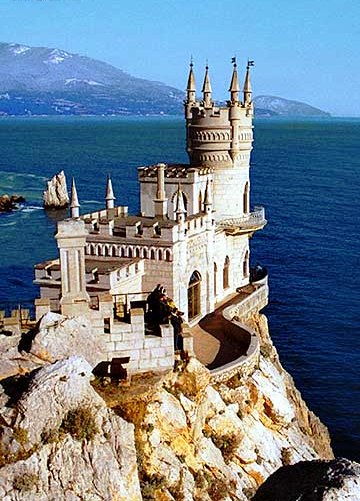
Find the location of `wall`. wall is located at coordinates (264, 305), (248, 365).